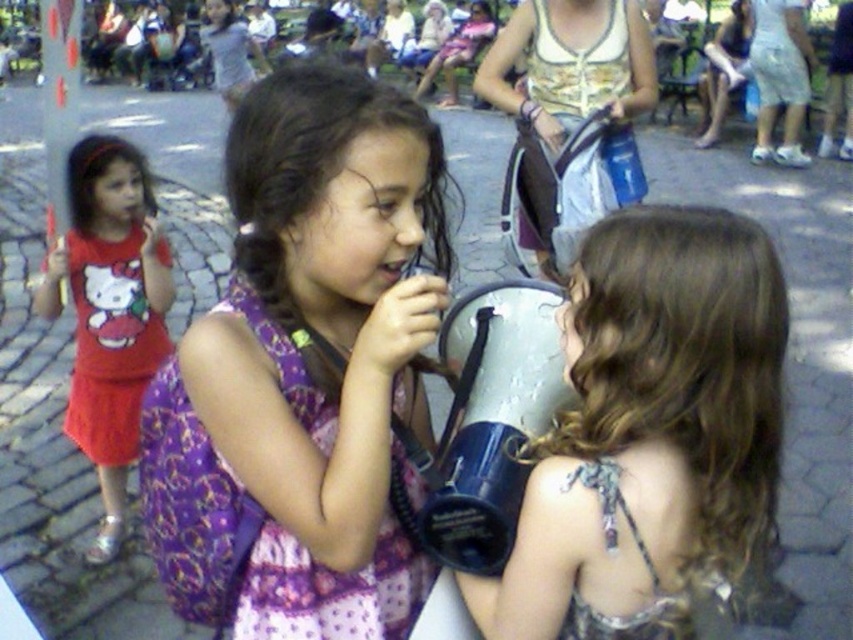
You are standing at the point with coordinates point (108,401) and want to move to the point with coordinates point (238,506). Is the destination point in front of or behind your current position?

The point (238,506) is in front of point (108,401), so the destination point is in front of your current position.

You are a photographer standing at the center of the scene. You want to take a photo that includes both the purple satin dress at center and the matte red dress at left. What is the minimum distance you need to move backward to ensure both subjects are in frame?

The distance between the purple satin dress at center and the matte red dress at left is 1.91 meters. To capture both in a single frame, you need to move back at least 1.91 meters to ensure both are within the camera view.

You are a photographer trying to capture a clear shot of both the shiny silver megaphone at center and the matte red dress at left. Based on their heights, which object will appear smaller in the photo?

The shiny silver megaphone at center has a lesser height compared to the matte red dress at left, so it will appear smaller in the photo.